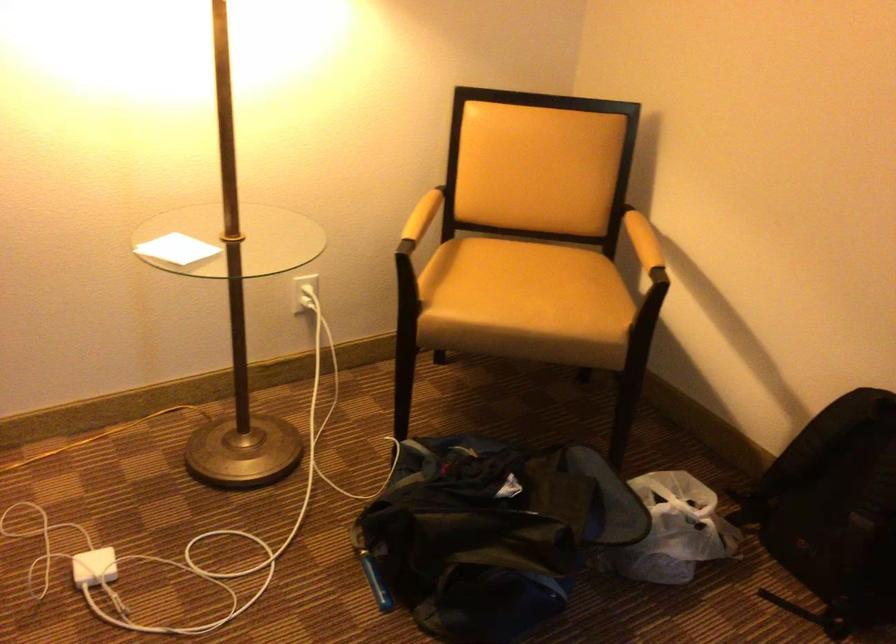
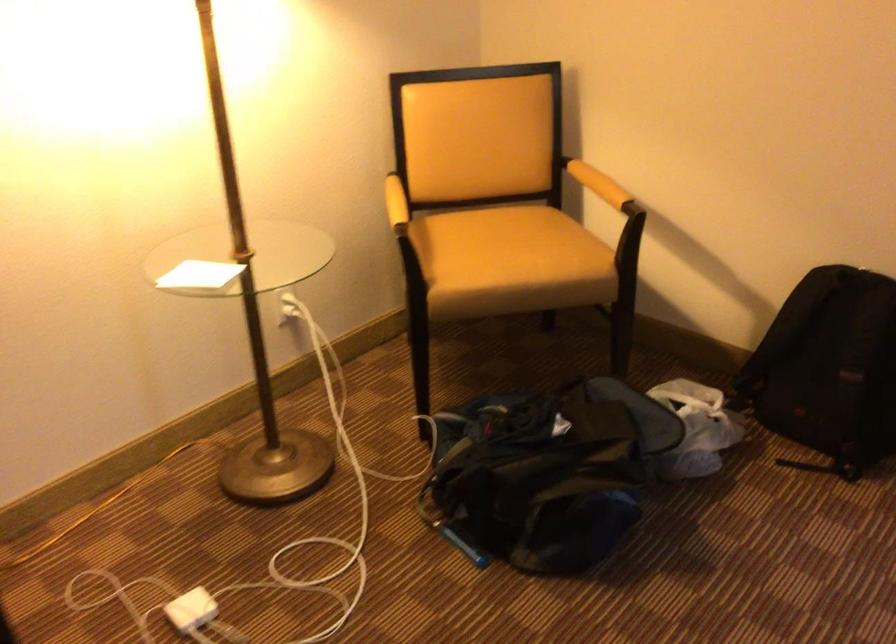
Find the pixel in the second image that matches [668,527] in the first image.

(696, 428)